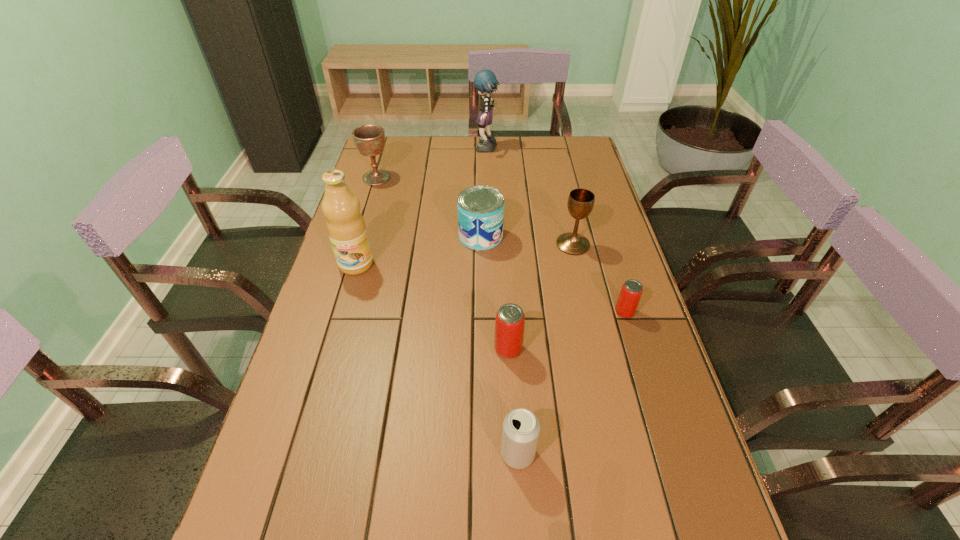
Where is `vacant region located on the back of the blue can`? The image size is (960, 540). vacant region located on the back of the blue can is located at coordinates tap(481, 177).

Where is `vacant space positioned on the back of the left pink beer can`? Image resolution: width=960 pixels, height=540 pixels. vacant space positioned on the back of the left pink beer can is located at coordinates click(x=506, y=301).

The image size is (960, 540). Identify the location of vacant area situated on the right of the white beer can. (676, 454).

Find the location of a particular element. Image resolution: width=960 pixels, height=540 pixels. vacant region located on the back of the smaller pink beer can is located at coordinates (606, 251).

Locate an element on the screen. This screenshot has height=540, width=960. object present at the far edge is located at coordinates (485, 81).

What are the coordinates of `olive oil that is positioned at the left edge` in the screenshot? It's located at (346, 227).

Where is `chalice at the left edge`? This screenshot has width=960, height=540. chalice at the left edge is located at coordinates (369, 139).

Find the location of a particular element. This screenshot has height=540, width=960. chalice that is at the right edge is located at coordinates (580, 204).

Where is `beer can that is at the right edge`? This screenshot has height=540, width=960. beer can that is at the right edge is located at coordinates (630, 294).

This screenshot has height=540, width=960. In order to click on vacant space at the far edge of the desktop in this screenshot , I will do `click(444, 147)`.